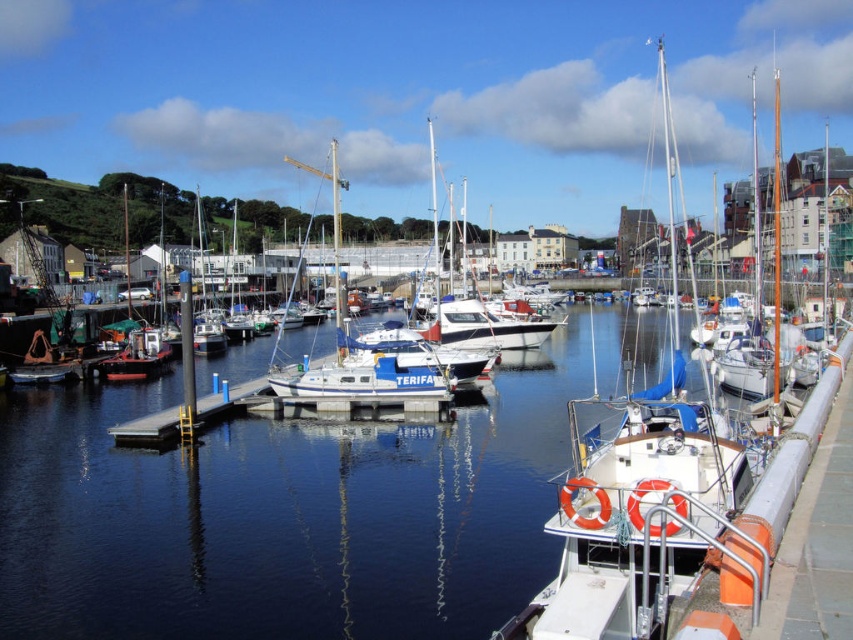
You are standing on the pier and see the clear water at center and the blue matte sailboat at center. Which object is closer to the surface of the water?

The blue matte sailboat at center is closer to the surface of the water because the clear water at center is located below it.

You are standing on the concrete walkway at the marina and see the white matte sailboat at center and the matte white sailboat at left. Which boat is closer to the orange and white safety barriers?

The matte white sailboat at left is closer to the orange and white safety barriers because the white matte sailboat at center is positioned on its right side.